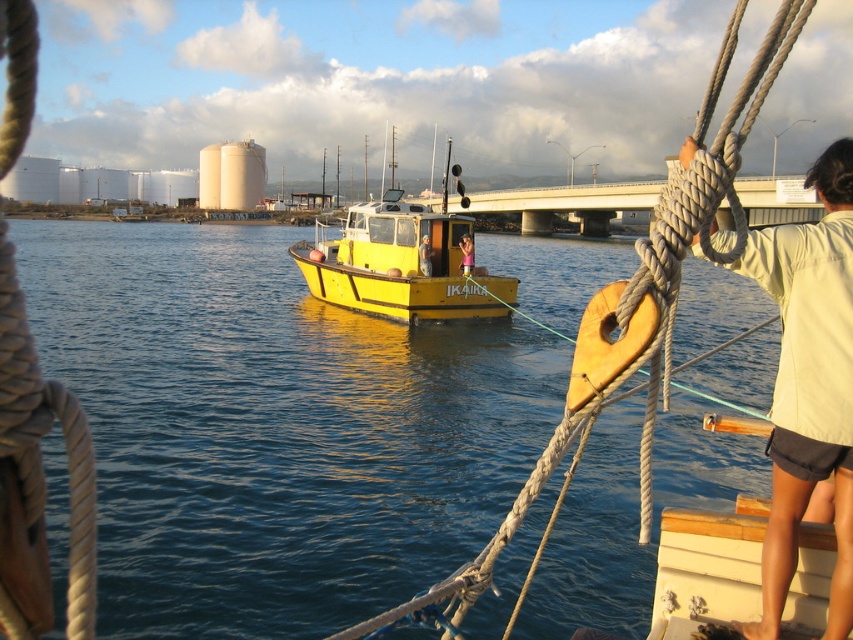
Locate an element on the screen. light beige fabric shirt at right is located at coordinates (809, 385).

Is point (807, 326) behind point (331, 257)?

That is False.

Which is behind, point (786, 374) or point (357, 232)?

Positioned behind is point (357, 232).

Where is `light beige fabric shirt at right`? The width and height of the screenshot is (853, 640). light beige fabric shirt at right is located at coordinates (809, 385).

Is point (514, 292) positioned behind point (427, 266)?

Yes, point (514, 292) is behind point (427, 266).

Can you confirm if yellow matte boat at center is positioned below light brown wooden door at center?

No, yellow matte boat at center is not below light brown wooden door at center.

Find the location of a particular element. The height and width of the screenshot is (640, 853). yellow matte boat at center is located at coordinates (401, 266).

Is shiny blue water at center to the right of pink fabric at center from the viewer's perspective?

No, shiny blue water at center is not to the right of pink fabric at center.

What do you see at coordinates (273, 428) in the screenshot? I see `shiny blue water at center` at bounding box center [273, 428].

Where is `shiny blue water at center`? The height and width of the screenshot is (640, 853). shiny blue water at center is located at coordinates (273, 428).

In order to click on shiny blue water at center in this screenshot , I will do pyautogui.click(x=273, y=428).